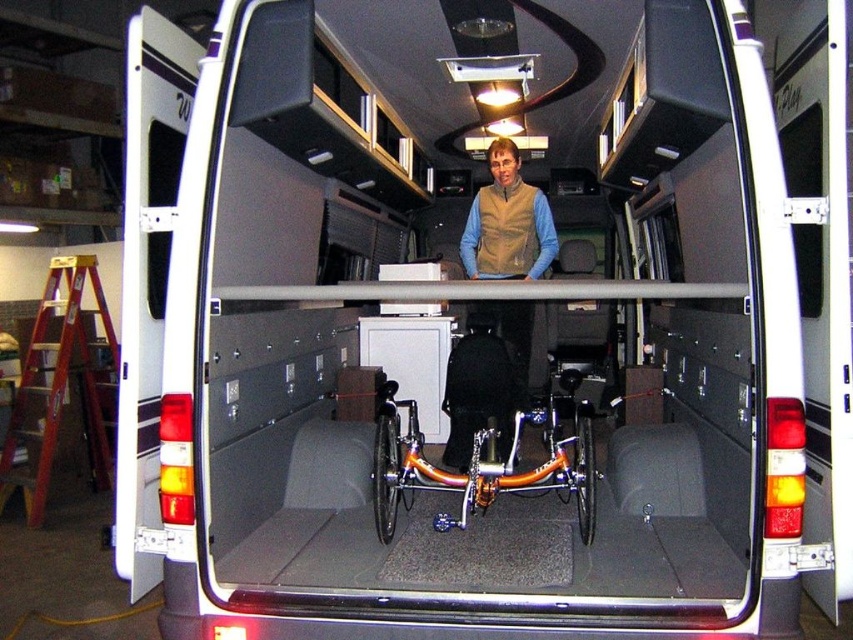
Is point (502, 138) more distant than point (485, 419)?

Yes, it is.

Does beige fleece vest at center come in front of matte black wheelchair at center?

No, it is not.

Locate an element on the screen. beige fleece vest at center is located at coordinates (508, 221).

Is point (33, 508) positioned before point (389, 422)?

No, it is behind (389, 422).

Does red wood ladder at left appear on the right side of orange metallic bicycle at center?

Incorrect, red wood ladder at left is not on the right side of orange metallic bicycle at center.

Does point (51, 369) come behind point (583, 532)?

Yes, point (51, 369) is farther from viewer.

Find the location of a particular element. red wood ladder at left is located at coordinates (61, 387).

Which is below, orange metallic bicycle at center or matte black wheelchair at center?

orange metallic bicycle at center is below.

How distant is orange metallic bicycle at center from matte black wheelchair at center?

The distance of orange metallic bicycle at center from matte black wheelchair at center is 10.15 inches.

At what (x,y) coordinates should I click in order to perform the action: click on orange metallic bicycle at center. Please return your answer as a coordinate pair (x, y). Looking at the image, I should click on [479, 465].